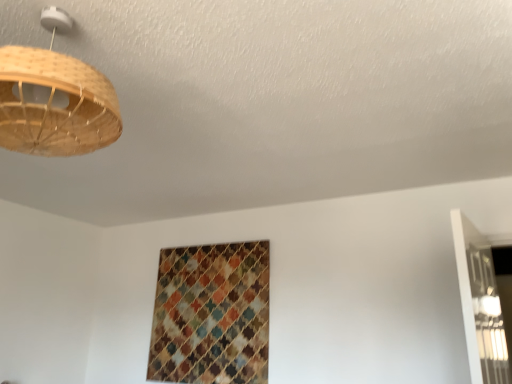
Identify the location of textured woven pattern at center. The width and height of the screenshot is (512, 384). (x=211, y=315).

The width and height of the screenshot is (512, 384). What do you see at coordinates (211, 315) in the screenshot?
I see `textured woven pattern at center` at bounding box center [211, 315].

This screenshot has width=512, height=384. I want to click on natural wood lampshade at upper left, so click(54, 99).

What do you see at coordinates (54, 99) in the screenshot? I see `natural wood lampshade at upper left` at bounding box center [54, 99].

I want to click on textured woven pattern at center, so click(x=211, y=315).

Considering the relative positions of textured woven pattern at center and natural wood lampshade at upper left in the image provided, is textured woven pattern at center to the right of natural wood lampshade at upper left from the viewer's perspective?

Correct, you'll find textured woven pattern at center to the right of natural wood lampshade at upper left.

Which object is further away from the camera taking this photo, textured woven pattern at center or natural wood lampshade at upper left?

Positioned behind is textured woven pattern at center.

In the scene shown: Which is nearer, (172, 321) or (40, 91)?

Point (172, 321) is positioned farther from the camera compared to point (40, 91).

From the image's perspective, relative to natural wood lampshade at upper left, is textured woven pattern at center above or below?

Clearly, from the image's perspective, textured woven pattern at center is below natural wood lampshade at upper left.

From a real-world perspective, who is located lower, textured woven pattern at center or natural wood lampshade at upper left?

From a 3D spatial view, textured woven pattern at center is below.

Which of these two, textured woven pattern at center or natural wood lampshade at upper left, is thinner?

textured woven pattern at center is thinner.

Who is taller, textured woven pattern at center or natural wood lampshade at upper left?

Standing taller between the two is textured woven pattern at center.

From the picture: Between textured woven pattern at center and natural wood lampshade at upper left, which one has smaller size?

Smaller between the two is textured woven pattern at center.

Is textured woven pattern at center completely or partially outside of natural wood lampshade at upper left?

Yes, textured woven pattern at center is not within natural wood lampshade at upper left.

Is there a large distance between textured woven pattern at center and natural wood lampshade at upper left?

textured woven pattern at center is positioned a significant distance from natural wood lampshade at upper left.

Is textured woven pattern at center looking in the opposite direction of natural wood lampshade at upper left?

textured woven pattern at center is not turned away from natural wood lampshade at upper left.

How distant is textured woven pattern at center from natural wood lampshade at upper left?

textured woven pattern at center and natural wood lampshade at upper left are 6.20 feet apart from each other.

You are a GUI agent. You are given a task and a screenshot of the screen. Output one action in this format:
    pyautogui.click(x=<x>, y=<y>)
    Task: Click on the lamp in front of the textured woven pattern at center
    This screenshot has height=384, width=512.
    Given the screenshot: What is the action you would take?
    pyautogui.click(x=54, y=99)

Considering the positions of objects natural wood lampshade at upper left and textured woven pattern at center in the image provided, who is more to the left, natural wood lampshade at upper left or textured woven pattern at center?

natural wood lampshade at upper left.

Which object is further away from the camera, natural wood lampshade at upper left or textured woven pattern at center?

textured woven pattern at center.

Is point (90, 67) closer or farther from the camera than point (154, 342)?

Clearly, point (90, 67) is closer to the camera than point (154, 342).

From the image's perspective, is natural wood lampshade at upper left located above or below textured woven pattern at center?

Based on their image positions, natural wood lampshade at upper left is located above textured woven pattern at center.

From a real-world perspective, relative to textured woven pattern at center, is natural wood lampshade at upper left vertically above or below?

natural wood lampshade at upper left is above textured woven pattern at center.

Does natural wood lampshade at upper left have a greater width compared to textured woven pattern at center?

Yes.

From their relative heights in the image, would you say natural wood lampshade at upper left is taller or shorter than textured woven pattern at center?

Clearly, natural wood lampshade at upper left is shorter compared to textured woven pattern at center.

From the picture: Who is bigger, natural wood lampshade at upper left or textured woven pattern at center?

natural wood lampshade at upper left.

Would you say textured woven pattern at center is part of natural wood lampshade at upper left's contents?

No, textured woven pattern at center is located outside of natural wood lampshade at upper left.

Is there a large distance between natural wood lampshade at upper left and textured woven pattern at center?

Yes, natural wood lampshade at upper left and textured woven pattern at center are quite far apart.

Looking at this image, does natural wood lampshade at upper left turn towards textured woven pattern at center?

Yes, natural wood lampshade at upper left is oriented towards textured woven pattern at center.

How many degrees apart are the facing directions of natural wood lampshade at upper left and textured woven pattern at center?

The angular difference between natural wood lampshade at upper left and textured woven pattern at center is 180 degrees.

Measure the distance from natural wood lampshade at upper left to textured woven pattern at center.

The distance of natural wood lampshade at upper left from textured woven pattern at center is 6.20 feet.

Where is `lamp in front of the textured woven pattern at center`? This screenshot has height=384, width=512. lamp in front of the textured woven pattern at center is located at coordinates (54, 99).

This screenshot has height=384, width=512. Find the location of `lamp above the textured woven pattern at center (from a real-world perspective)`. lamp above the textured woven pattern at center (from a real-world perspective) is located at coordinates (54, 99).

This screenshot has width=512, height=384. Identify the location of lamp that is in front of the textured woven pattern at center. (54, 99).